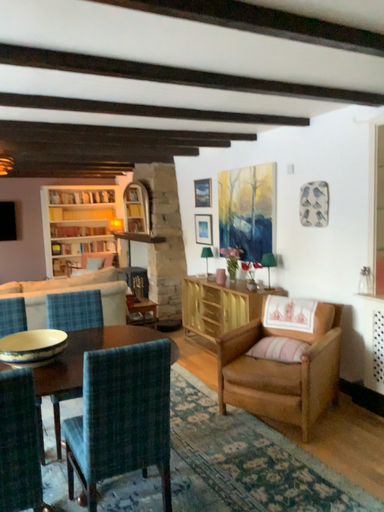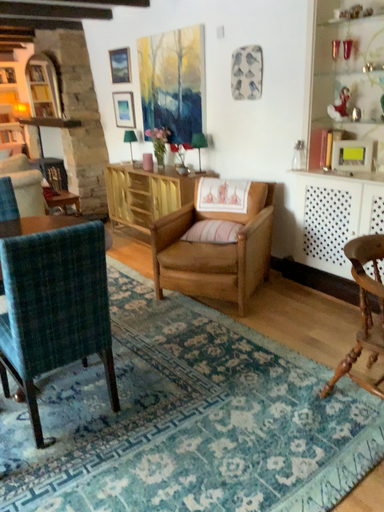
Question: How did the camera likely rotate when shooting the video?

Choices:
 (A) rotated right
 (B) rotated left

Answer: (A)